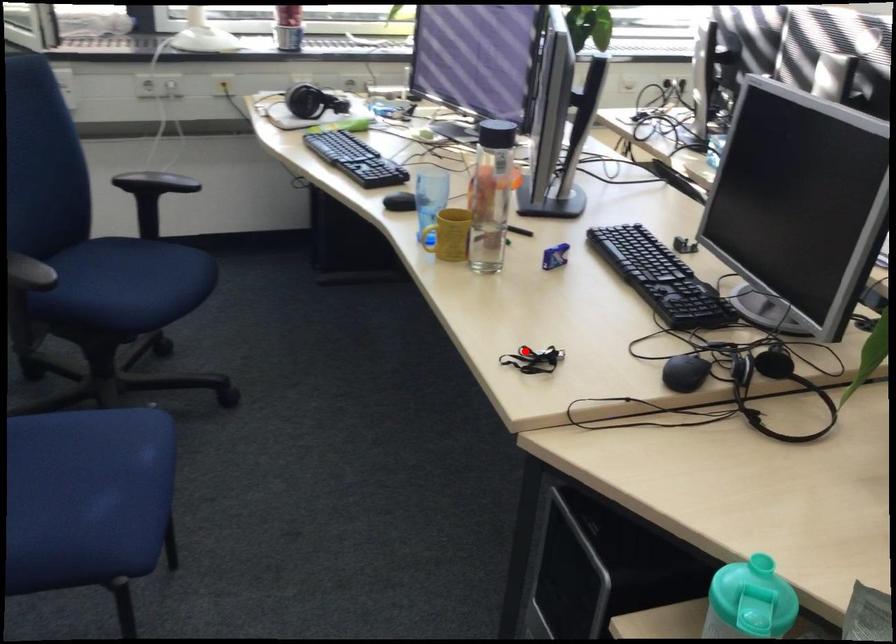
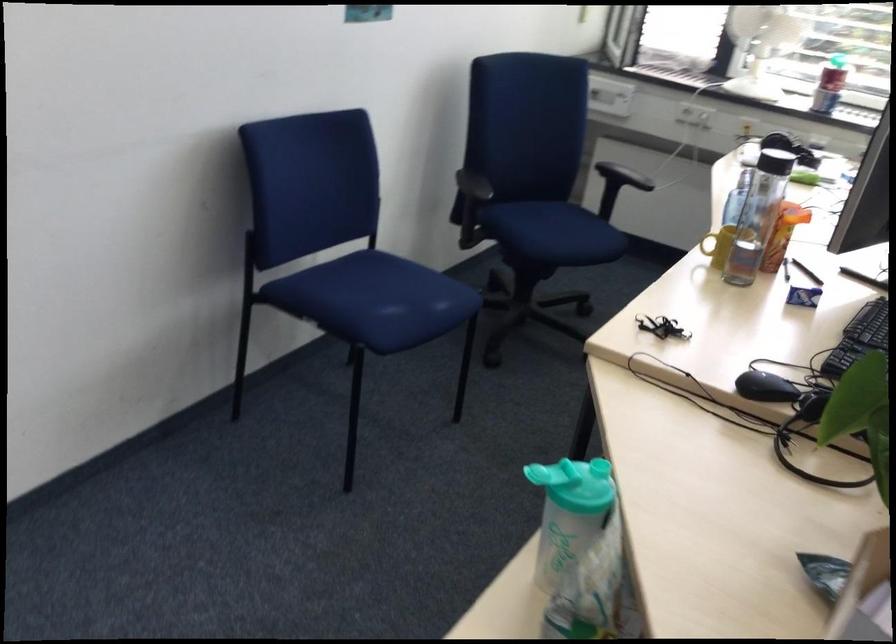
Find the pixel in the second image that matches the highlighted location in the first image.

(661, 327)